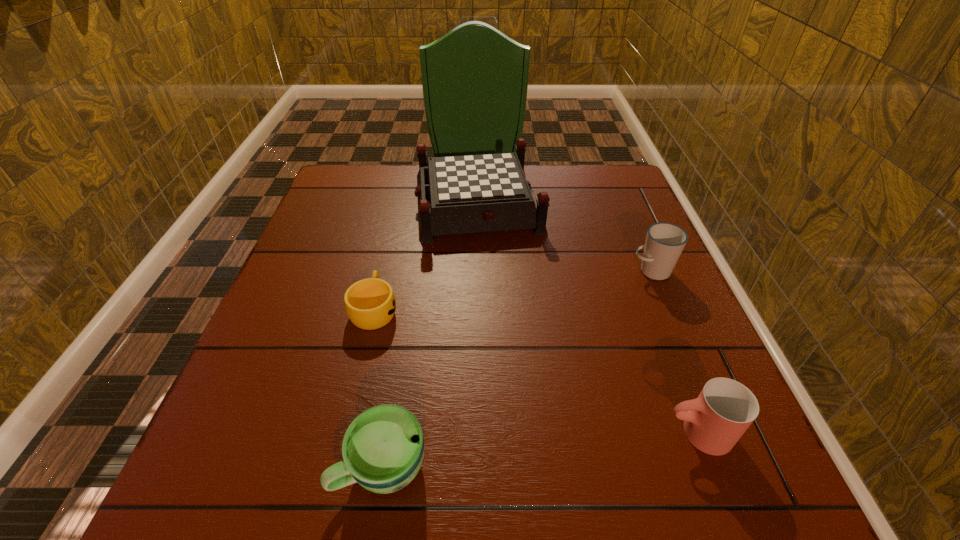
Find the location of a particular element. blank region between the third nearest cup and the farthest cup is located at coordinates (513, 290).

Locate an element on the screen. The width and height of the screenshot is (960, 540). vacant space that's between the farthest cup and the third nearest object is located at coordinates 513,290.

Identify which object is the fourth nearest to the farthest object. Please provide its 2D coordinates. Your answer should be formatted as a tuple, i.e. [(x, y)], where the tuple contains the x and y coordinates of a point satisfying the conditions above.

[(383, 448)]

Identify which object is the third nearest to the shortest object. Please provide its 2D coordinates. Your answer should be formatted as a tuple, i.e. [(x, y)], where the tuple contains the x and y coordinates of a point satisfying the conditions above.

[(714, 422)]

Where is `cup that can be found as the second closest to the checkerboard`? Image resolution: width=960 pixels, height=540 pixels. cup that can be found as the second closest to the checkerboard is located at coordinates (665, 242).

Locate which cup is the closest to the farthest object. Please provide its 2D coordinates. Your answer should be formatted as a tuple, i.e. [(x, y)], where the tuple contains the x and y coordinates of a point satisfying the conditions above.

[(370, 303)]